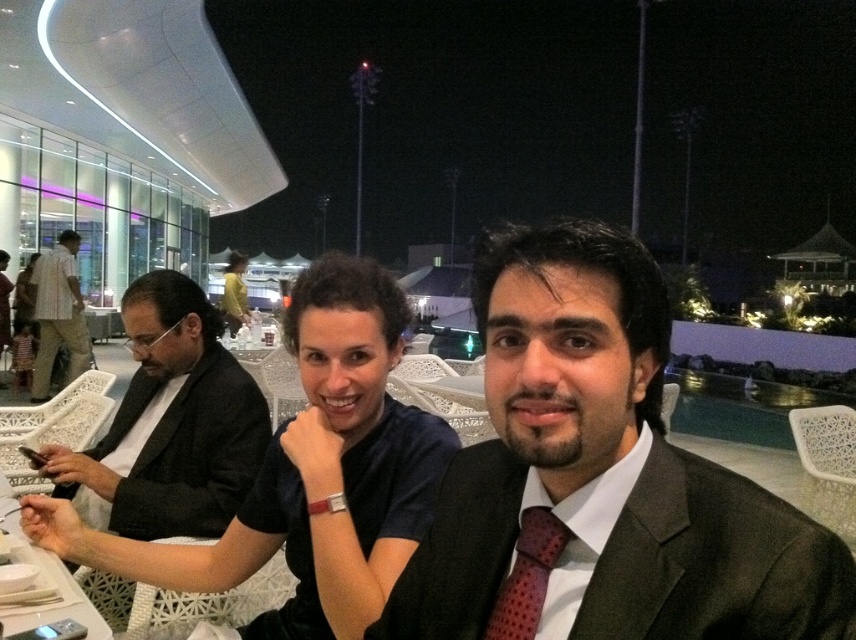
You are a photographer standing at the back of the venue and want to take a photo of both the matte black suit at center and the matte black suit at left. The camera you are using has a maximum focus range of 6 meters. Will both subjects be within the focus range of the camera?

The matte black suit at center and matte black suit at left are 7.33 meters apart, so the distance between them exceeds the camera focus range of 6 meters. Therefore, both subjects cannot be in focus simultaneously.

You are a photographer trying to capture a clear shot of both the matte black suit at center and the matte black suit at left. However, you notice that one of them is blocking the view of the other. Which one is blocking the other?

The matte black suit at center is positioned under the matte black suit at left, so the matte black suit at center is blocking the view of the matte black suit at left.